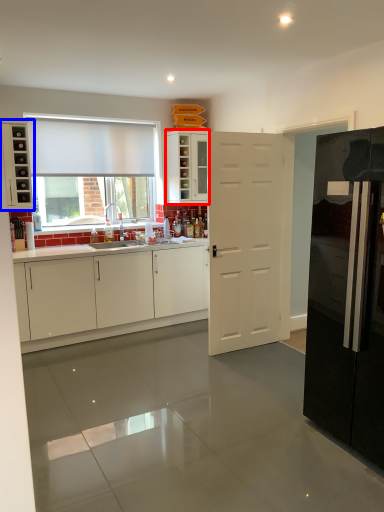
Question: Which object appears closest to the camera in this image, cabinetry (highlighted by a red box) or cabinetry (highlighted by a blue box)?

Choices:
 (A) cabinetry
 (B) cabinetry

Answer: (B)